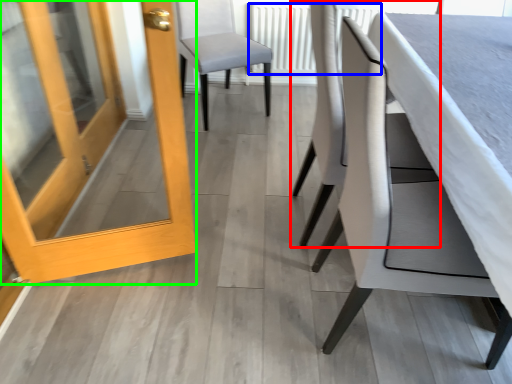
Question: Which is nearer to the chair (highlighted by a red box)? radiator (highlighted by a blue box) or door (highlighted by a green box).

Choices:
 (A) radiator
 (B) door

Answer: (B)